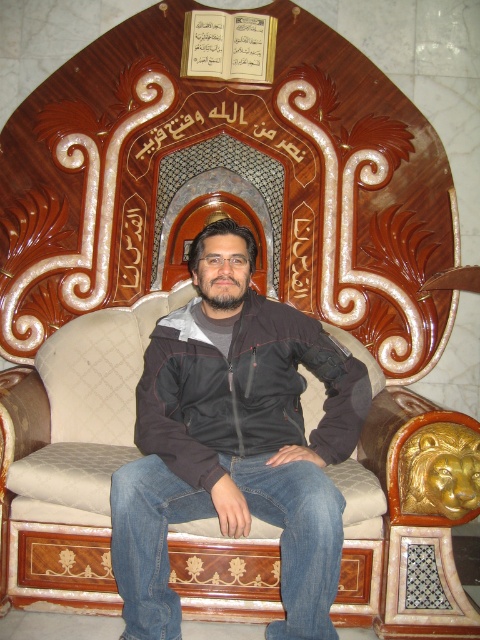
Question: Is black softshell jacket at center closer to the viewer compared to wooden carved book at upper center?

Choices:
 (A) no
 (B) yes

Answer: (B)

Question: Is black matte jacket at center positioned behind wooden carved book at upper center?

Choices:
 (A) yes
 (B) no

Answer: (B)

Question: Which of the following is the farthest from the observer?

Choices:
 (A) (178, 458)
 (B) (156, 420)

Answer: (B)

Question: Is black matte jacket at center smaller than black softshell jacket at center?

Choices:
 (A) yes
 (B) no

Answer: (B)

Question: Among these objects, which one is nearest to the camera?

Choices:
 (A) black softshell jacket at center
 (B) wooden carved book at upper center
 (C) black matte jacket at center

Answer: (C)

Question: Estimate the real-world distances between objects in this image. Which object is farther from the black matte jacket at center?

Choices:
 (A) black softshell jacket at center
 (B) wooden carved book at upper center

Answer: (B)